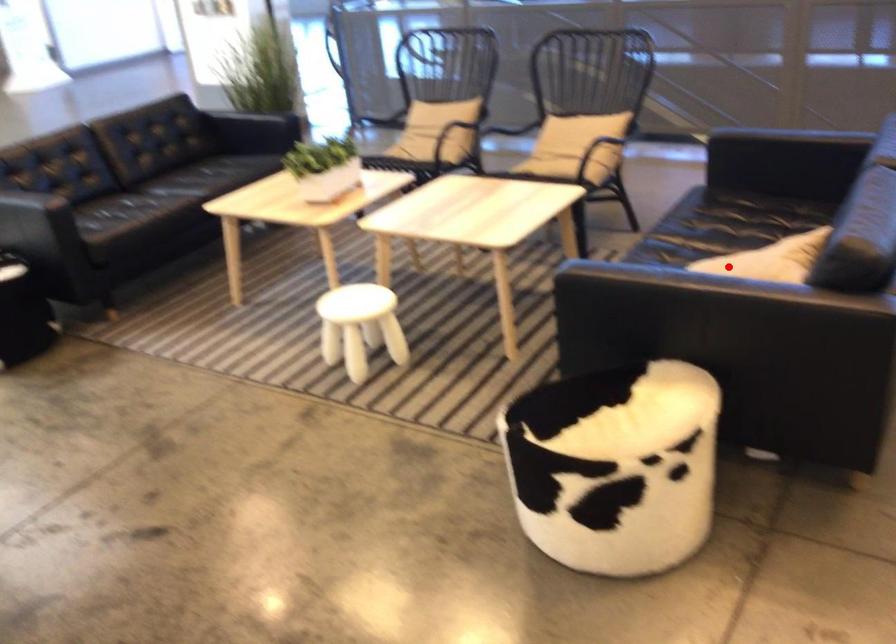
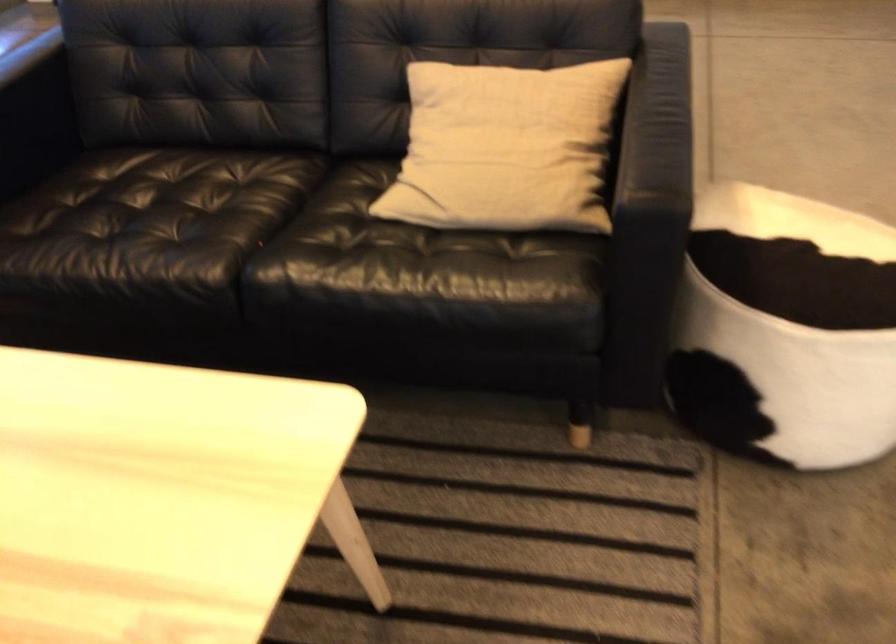
Find the pixel in the second image that matches the highlighted location in the first image.

(505, 147)